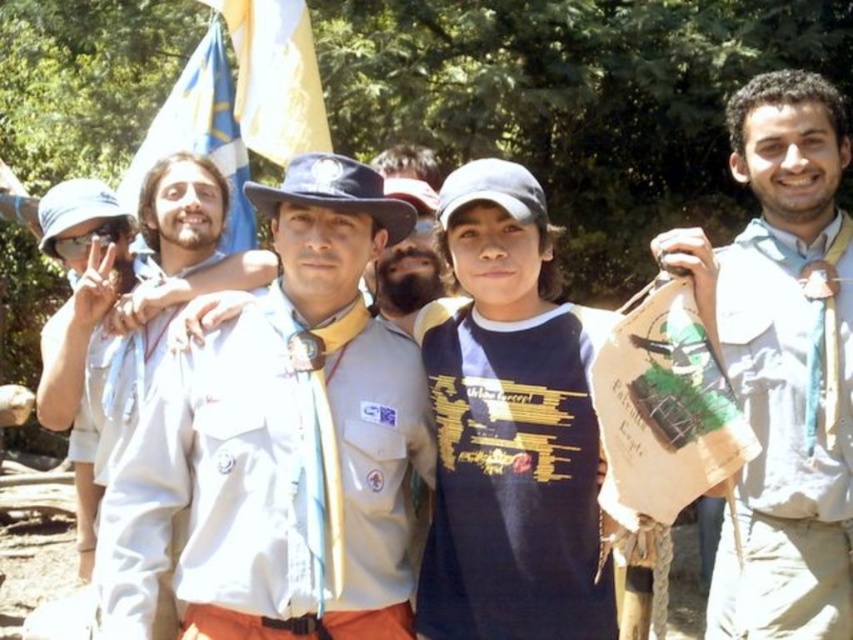
Does white fabric shirt at right have a smaller size compared to blue fabric flag at upper center?

No, white fabric shirt at right is not smaller than blue fabric flag at upper center.

You are a GUI agent. You are given a task and a screenshot of the screen. Output one action in this format:
    pyautogui.click(x=<x>, y=<y>)
    Task: Click on the white fabric shirt at right
    The height and width of the screenshot is (640, 853).
    Given the screenshot: What is the action you would take?
    pyautogui.click(x=785, y=360)

You are a GUI agent. You are given a task and a screenshot of the screen. Output one action in this format:
    pyautogui.click(x=<x>, y=<y>)
    Task: Click on the white fabric shirt at right
    The image size is (853, 640).
    Given the screenshot: What is the action you would take?
    pyautogui.click(x=785, y=360)

Where is `white fabric shirt at right`? white fabric shirt at right is located at coordinates (785, 360).

Is navy blue jersey at center shorter than blue fabric flag at upper left?

Yes, navy blue jersey at center is shorter than blue fabric flag at upper left.

Can you confirm if navy blue jersey at center is bigger than blue fabric flag at upper left?

No, navy blue jersey at center is not bigger than blue fabric flag at upper left.

I want to click on navy blue jersey at center, so click(x=512, y=477).

You are a GUI agent. You are given a task and a screenshot of the screen. Output one action in this format:
    pyautogui.click(x=<x>, y=<y>)
    Task: Click on the navy blue jersey at center
    The height and width of the screenshot is (640, 853).
    Given the screenshot: What is the action you would take?
    pyautogui.click(x=512, y=477)

Is white fabric uniform at center positioned at the back of navy blue jersey at center?

No, it is in front of navy blue jersey at center.

Between point (311, 605) and point (599, 628), which one is positioned in front?

Positioned in front is point (311, 605).

This screenshot has width=853, height=640. In order to click on white fabric uniform at center in this screenshot , I will do `click(265, 474)`.